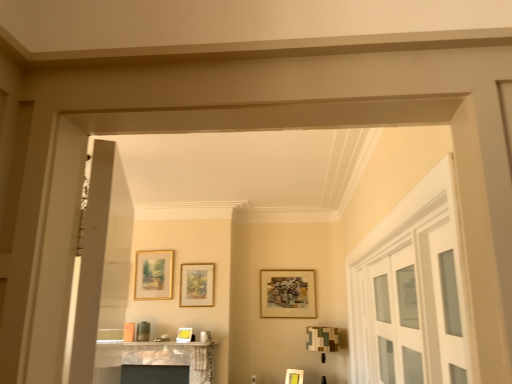
What do you see at coordinates (287, 294) in the screenshot? The width and height of the screenshot is (512, 384). I see `wooden picture frame at center, the second picture frame from the right` at bounding box center [287, 294].

Describe the element at coordinates (294, 376) in the screenshot. I see `matte gold picture frame at center, the 1th picture frame in the right-to-left sequence` at that location.

In the scene shown: What is the approximate height of white glass door at right?

white glass door at right is 3.55 feet in height.

This screenshot has height=384, width=512. What do you see at coordinates (153, 275) in the screenshot?
I see `matte gold picture frame at upper left, which is counted as the 5th picture frame, starting from the right` at bounding box center [153, 275].

Locate an element on the screen. The height and width of the screenshot is (384, 512). wooden picture frame at center, the second picture frame from the right is located at coordinates (287, 294).

From the image's perspective, would you say matte gold picture frame at upper left, which is counted as the 5th picture frame, starting from the right, is shown under white glass door at right?

No, from the image's perspective, matte gold picture frame at upper left, which is counted as the 5th picture frame, starting from the right, is not beneath white glass door at right.

Between matte gold picture frame at upper left, the 1th picture frame positioned from the left, and white glass door at right, which one has more height?

white glass door at right.

Is matte gold picture frame at upper left, which is counted as the 5th picture frame, starting from the right, smaller than white glass door at right?

Correct, matte gold picture frame at upper left, which is counted as the 5th picture frame, starting from the right, occupies less space than white glass door at right.

Does matte gold picture frame at upper left, which is counted as the 5th picture frame, starting from the right, have a greater width compared to white glass door at right?

No.

Is matte gold picture frame at center, acting as the 4th picture frame starting from the right, at the back of matte gold picture frame at upper left, which is counted as the 5th picture frame, starting from the right?

No, matte gold picture frame at upper left, which is counted as the 5th picture frame, starting from the right, is not facing the opposite direction of matte gold picture frame at center, acting as the 4th picture frame starting from the right.

From the image's perspective, starting from the matte gold picture frame at center, which is the second picture frame from left to right, which picture frame is the 3rd one above? Please provide its 2D coordinates.

[(153, 275)]

In the image, is matte gold picture frame at upper left, which is counted as the 5th picture frame, starting from the right, positioned in front of or behind matte gold picture frame at center, acting as the 4th picture frame starting from the right?

matte gold picture frame at upper left, which is counted as the 5th picture frame, starting from the right, is behind matte gold picture frame at center, acting as the 4th picture frame starting from the right.

How far apart are wooden picture frame at center, the fourth picture frame in the left-to-right sequence, and white glass door at right?

wooden picture frame at center, the fourth picture frame in the left-to-right sequence, and white glass door at right are 6.53 feet apart.

You are a GUI agent. You are given a task and a screenshot of the screen. Output one action in this format:
    pyautogui.click(x=<x>, y=<y>)
    Task: Click on the door above the wooden picture frame at center, the fourth picture frame in the left-to-right sequence (from the image's perspective)
    The height and width of the screenshot is (384, 512).
    Given the screenshot: What is the action you would take?
    pyautogui.click(x=411, y=292)

Does point (279, 308) appear closer or farther from the camera than point (440, 367)?

Clearly, point (279, 308) is more distant from the camera than point (440, 367).

Could you tell me if wooden picture frame at center, the fourth picture frame in the left-to-right sequence, is facing white glass door at right?

Yes, wooden picture frame at center, the fourth picture frame in the left-to-right sequence, is oriented towards white glass door at right.

In the image, is matte gold picture frame at center, the third picture frame from the right, on the left side or the right side of white glass door at right?

Based on their positions, matte gold picture frame at center, the third picture frame from the right, is located to the left of white glass door at right.

Which is nearer, [183,286] or [423,339]?

The point [423,339] is in front.

From the image's perspective, between matte gold picture frame at center, the third picture frame from the right, and white glass door at right, who is located below?

From the image's view, matte gold picture frame at center, the third picture frame from the right, is below.

Is white glass door at right located within matte gold picture frame at center, the third picture frame from the right?

Actually, white glass door at right is outside matte gold picture frame at center, the third picture frame from the right.

Looking at the image, does white glass door at right seem bigger or smaller compared to matte gold picture frame at center, the third picture frame from the right?

Considering their sizes, white glass door at right takes up more space than matte gold picture frame at center, the third picture frame from the right.

Identify the location of picture frame that is the 3rd one when counting leftward from the white glass door at right. (197, 285).

Which is farther, (x=408, y=352) or (x=196, y=293)?

Positioned behind is point (x=196, y=293).

Is white glass door at right positioned behind matte gold picture frame at center, placed as the 3th picture frame when sorted from left to right?

No, it is not.

From the image's perspective, is wooden picture frame at center, the second picture frame from the right, under marble fireplace at lower center?

Actually, wooden picture frame at center, the second picture frame from the right, appears above marble fireplace at lower center in the image.

Can you tell me how much wooden picture frame at center, the fourth picture frame in the left-to-right sequence, and marble fireplace at lower center differ in facing direction?

0.42 degrees separate the facing orientations of wooden picture frame at center, the fourth picture frame in the left-to-right sequence, and marble fireplace at lower center.

Which is correct: wooden picture frame at center, the fourth picture frame in the left-to-right sequence, is inside marble fireplace at lower center, or outside of it?

wooden picture frame at center, the fourth picture frame in the left-to-right sequence, is outside marble fireplace at lower center.

There is a marble fireplace at lower center. Where is `the 2nd picture frame above it (from a real-world perspective)`? the 2nd picture frame above it (from a real-world perspective) is located at coordinates (287, 294).

Is point (211, 272) positioned after point (211, 370)?

That is True.

Is matte gold picture frame at center, placed as the 3th picture frame when sorted from left to right, smaller than marble fireplace at lower center?

Correct, matte gold picture frame at center, placed as the 3th picture frame when sorted from left to right, occupies less space than marble fireplace at lower center.

From the image's perspective, is matte gold picture frame at center, placed as the 3th picture frame when sorted from left to right, above or below marble fireplace at lower center?

Based on their image positions, matte gold picture frame at center, placed as the 3th picture frame when sorted from left to right, is located above marble fireplace at lower center.

Where is `door on the right of matte gold picture frame at upper left, which is counted as the 5th picture frame, starting from the right`? The width and height of the screenshot is (512, 384). door on the right of matte gold picture frame at upper left, which is counted as the 5th picture frame, starting from the right is located at coordinates (411, 292).

The image size is (512, 384). I want to click on picture frame that is the 3rd object located behind the matte gold picture frame at center, acting as the 4th picture frame starting from the right, so click(x=153, y=275).

From the image, which object appears to be farther from matte gold picture frame at upper left, which is counted as the 5th picture frame, starting from the right, matte gold picture frame at center, acting as the 4th picture frame starting from the right, or clear glass cabinet at right?

Among the two, clear glass cabinet at right is located further to matte gold picture frame at upper left, which is counted as the 5th picture frame, starting from the right.

Looking at the image, which one is located closer to marble fireplace at lower center, matte gold picture frame at center, acting as the 4th picture frame starting from the right, or wooden picture frame at center, the fourth picture frame in the left-to-right sequence?

The object closer to marble fireplace at lower center is matte gold picture frame at center, acting as the 4th picture frame starting from the right.

Considering their positions, is wooden picture frame at center, the fourth picture frame in the left-to-right sequence, positioned further to marble fireplace at lower center than clear glass cabinet at right?

Among the two, clear glass cabinet at right is located further to marble fireplace at lower center.

Based on their spatial positions, is matte gold picture frame at upper left, the 1th picture frame positioned from the left, or matte gold picture frame at center, which is the second picture frame from left to right, further from white glass door at right?

matte gold picture frame at upper left, the 1th picture frame positioned from the left.

Based on their spatial positions, is marble fireplace at lower center or camouflage fabric lampshade at right closer to clear glass cabinet at right?

camouflage fabric lampshade at right.

Looking at the image, which one is located further to clear glass cabinet at right, matte gold picture frame at center, the 1th picture frame in the right-to-left sequence, or white glass door at right?

matte gold picture frame at center, the 1th picture frame in the right-to-left sequence, is further to clear glass cabinet at right.

When comparing their distances from clear glass cabinet at right, does marble fireplace at lower center or matte gold picture frame at center, the 1th picture frame in the right-to-left sequence, seem closer?

Among the two, matte gold picture frame at center, the 1th picture frame in the right-to-left sequence, is located nearer to clear glass cabinet at right.

Which object lies nearer to the anchor point matte gold picture frame at center, which is the second picture frame from left to right, matte gold picture frame at center, which ranks as the fifth picture frame in left-to-right order, or wooden picture frame at center, the second picture frame from the right?

wooden picture frame at center, the second picture frame from the right, lies closer to matte gold picture frame at center, which is the second picture frame from left to right, than the other object.

Locate an element on the screen. screen door between white glass door at right and wooden picture frame at center, the second picture frame from the right, from front to back is located at coordinates (396, 318).

This screenshot has height=384, width=512. Find the location of `screen door positioned between white glass door at right and matte gold picture frame at upper left, which is counted as the 5th picture frame, starting from the right, from near to far`. screen door positioned between white glass door at right and matte gold picture frame at upper left, which is counted as the 5th picture frame, starting from the right, from near to far is located at coordinates (396, 318).

At what (x,y) coordinates should I click in order to perform the action: click on table located between white glass door at right and matte gold picture frame at center, acting as the 4th picture frame starting from the right, in the depth direction. Please return your answer as a coordinate pair (x, y). This screenshot has width=512, height=384. Looking at the image, I should click on (153, 358).

This screenshot has height=384, width=512. I want to click on table between clear glass cabinet at right and camouflage fabric lampshade at right from front to back, so click(153, 358).